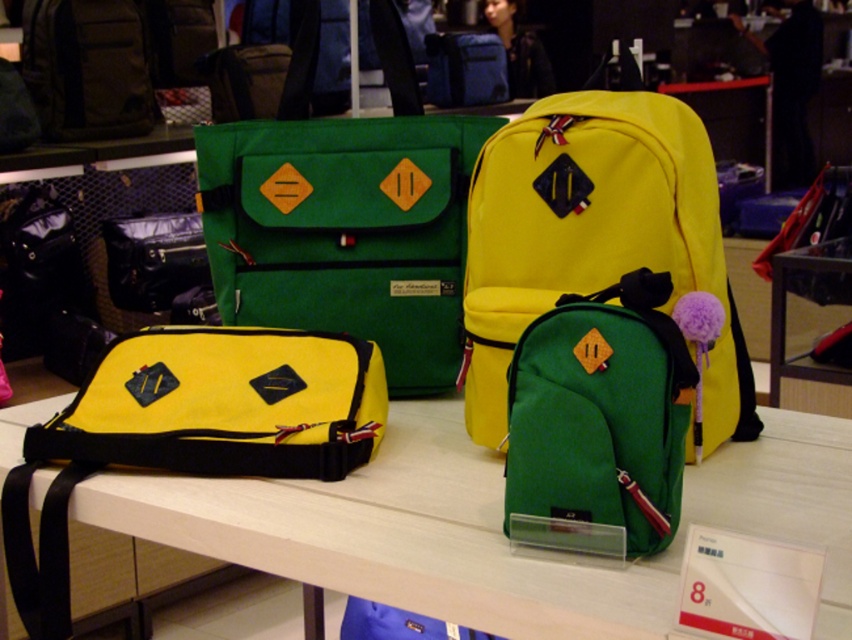
Question: Among these points, which one is farthest from the camera?

Choices:
 (A) (809, 232)
 (B) (68, 589)
 (C) (91, 8)
 (D) (655, 632)

Answer: (C)

Question: From the image, what is the correct spatial relationship of matte black camera at center in relation to matte yellow backpack at center?

Choices:
 (A) left
 (B) right

Answer: (A)

Question: Which point is closer to the camera?

Choices:
 (A) matte blue backpack at upper center
 (B) matte yellow fabric bag at upper left
 (C) green felt backpack at center
 (D) matte black camera at center

Answer: (B)

Question: Is yellow fabric duffel at center above matte yellow backpack at center?

Choices:
 (A) no
 (B) yes

Answer: (A)

Question: Can you confirm if green felt backpack at center is wider than matte yellow backpack at center?

Choices:
 (A) no
 (B) yes

Answer: (B)

Question: Which of the following is the closest to the observer?

Choices:
 (A) (792, 237)
 (B) (556, 486)
 (C) (781, 436)
 (D) (334, 387)

Answer: (B)